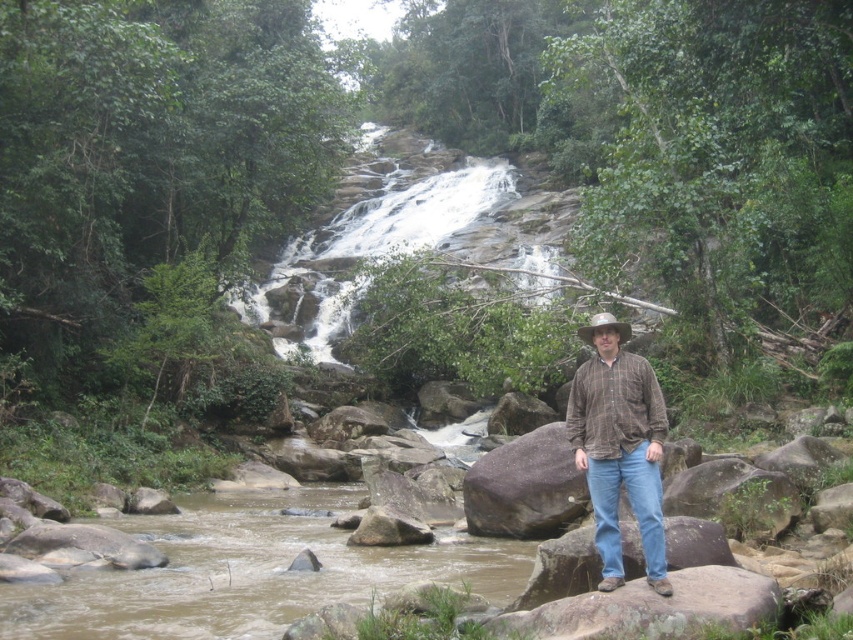
Which is more to the right, brown plaid shirt at center or brown woven cowboy hat at center?

From the viewer's perspective, brown woven cowboy hat at center appears more on the right side.

Based on the photo, is the position of brown plaid shirt at center less distant than that of brown woven cowboy hat at center?

Yes, it is in front of brown woven cowboy hat at center.

Does point (596, 456) come behind point (596, 314)?

No, it is in front of (596, 314).

This screenshot has height=640, width=853. In order to click on brown plaid shirt at center in this screenshot , I will do `click(619, 445)`.